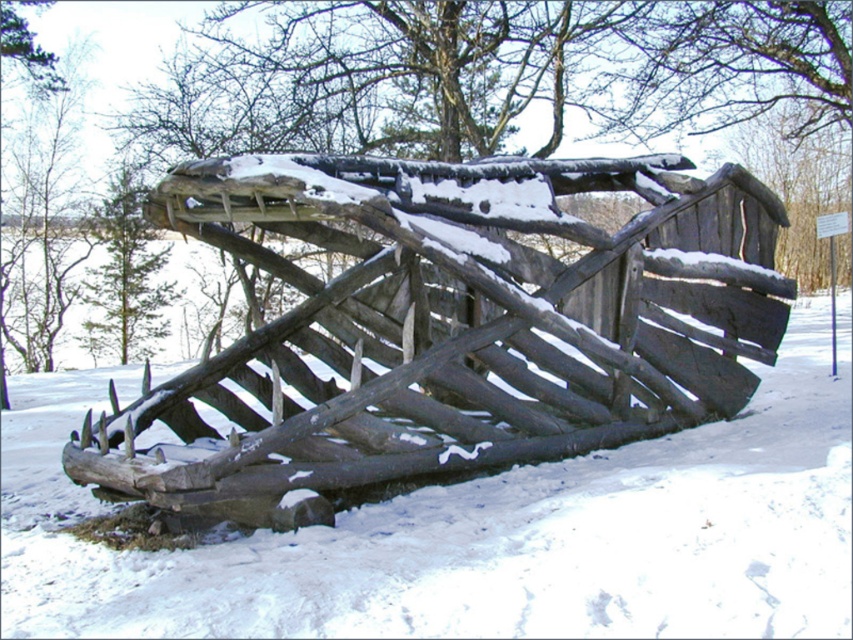
Question: Is rustic wooden fence at center positioned before white matte snow at lower center?

Choices:
 (A) no
 (B) yes

Answer: (A)

Question: Where is rustic wooden fence at center located in relation to white matte snow at lower center in the image?

Choices:
 (A) left
 (B) right

Answer: (A)

Question: Which point is closer to the camera?

Choices:
 (A) (35, 422)
 (B) (85, 472)

Answer: (B)

Question: Which point is closer to the camera?

Choices:
 (A) white matte snow at lower center
 (B) rustic wooden fence at center

Answer: (A)

Question: Is rustic wooden fence at center thinner than white matte snow at lower center?

Choices:
 (A) yes
 (B) no

Answer: (A)

Question: Which point is farther to the camera?

Choices:
 (A) (129, 595)
 (B) (354, 198)

Answer: (B)